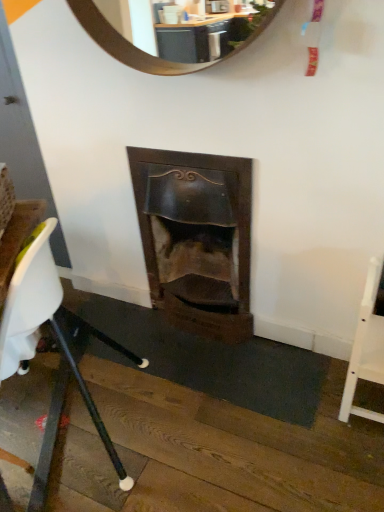
You are a GUI agent. You are given a task and a screenshot of the screen. Output one action in this format:
    pyautogui.click(x=<x>, y=<y>)
    Task: Click on the free space in front of wooden fireplace at center
    
    Given the screenshot: What is the action you would take?
    pyautogui.click(x=207, y=375)